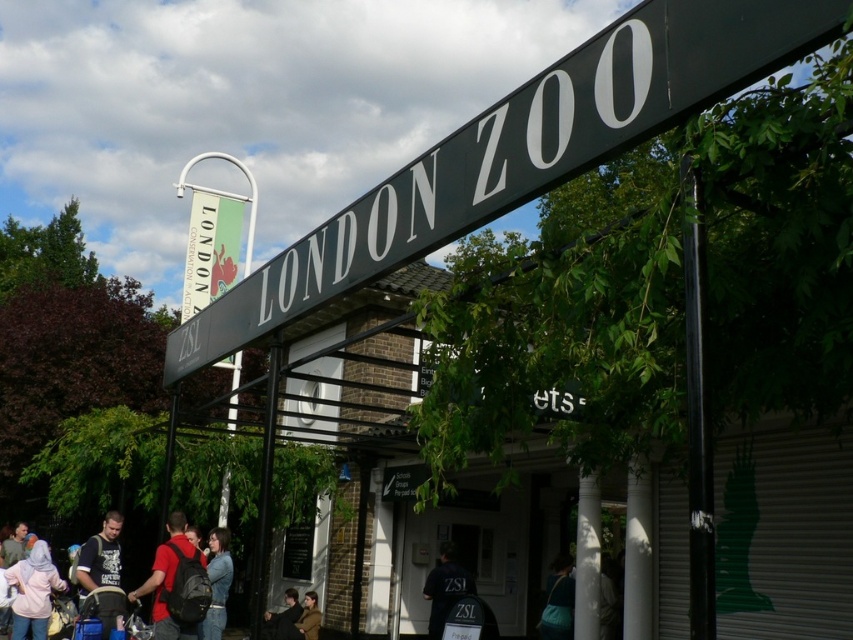
You are standing at the entrance of London Zoo and see a pale pink fabric hijab at lower left and a matte black backpack at lower left. Which one is positioned more to the left side?

The pale pink fabric hijab at lower left is positioned more to the left side than the matte black backpack at lower left.

Looking at this image, you are standing at the entrance of London Zoo and notice the black metal pole at right and the denim jacket at lower center. Which object appears smaller in the image?

The black metal pole at right appears smaller than the denim jacket at lower center.